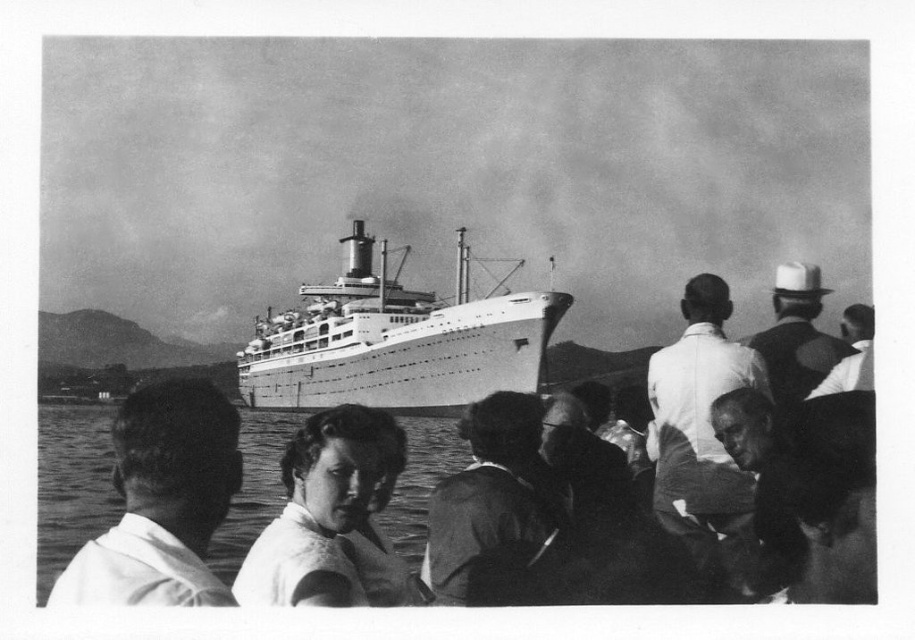
Does point (695, 392) come farther from viewer compared to point (797, 337)?

No.

The height and width of the screenshot is (640, 915). What do you see at coordinates (703, 436) in the screenshot?
I see `white cotton shirt at center-right` at bounding box center [703, 436].

I want to click on white cotton shirt at center-right, so click(x=703, y=436).

Is white smooth ship at center shorter than smooth white hat at upper right?

No, white smooth ship at center is not shorter than smooth white hat at upper right.

This screenshot has height=640, width=915. What do you see at coordinates (395, 342) in the screenshot?
I see `white smooth ship at center` at bounding box center [395, 342].

Where is `white smooth ship at center`? white smooth ship at center is located at coordinates (395, 342).

Can you confirm if white cotton shirt at center-right is positioned below smooth leather jacket at center?

No.

Does white cotton shirt at center-right have a lesser height compared to smooth leather jacket at center?

In fact, white cotton shirt at center-right may be taller than smooth leather jacket at center.

I want to click on white cotton shirt at center-right, so click(x=703, y=436).